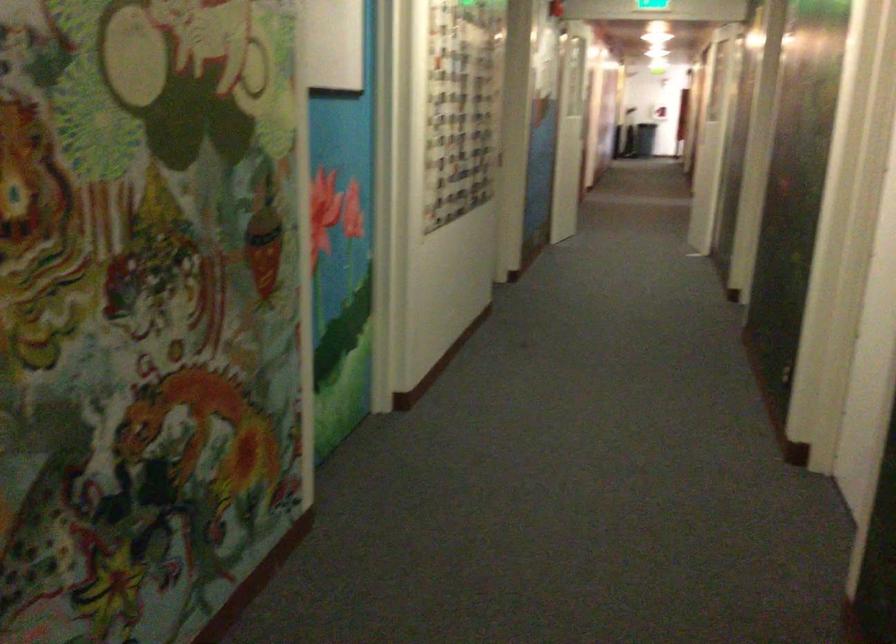
Where is `black trash can`? Image resolution: width=896 pixels, height=644 pixels. black trash can is located at coordinates (644, 140).